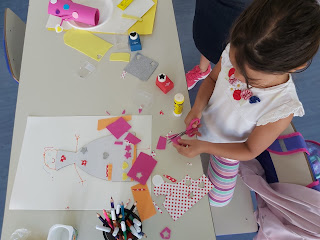
Image resolution: width=320 pixels, height=240 pixels. In order to click on bottle in this screenshot , I will do `click(166, 87)`.